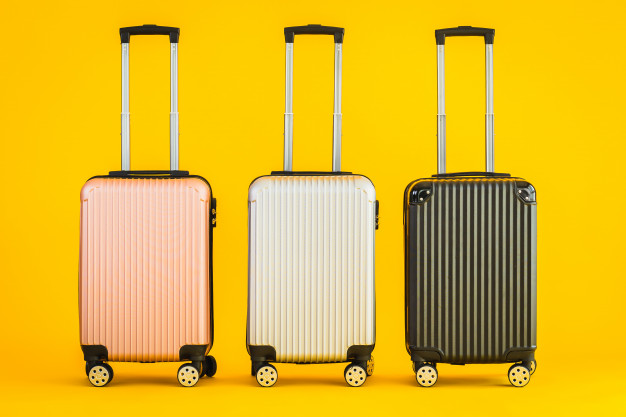
The height and width of the screenshot is (417, 626). In order to click on casters in this screenshot , I will do `click(101, 373)`, `click(186, 372)`, `click(268, 373)`, `click(360, 374)`, `click(429, 378)`, `click(518, 376)`.